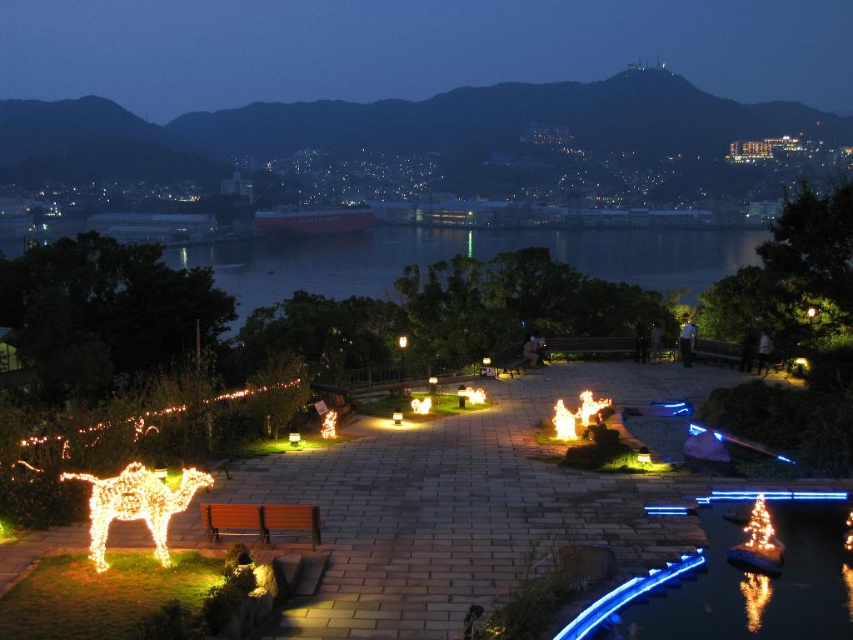
You are standing at the entrance of the park and want to reach the illuminated wireframe camel at lower left. According to the coordinates provided, in which direction should you walk from your current position to reach it?

The illuminated wireframe camel at lower left is located at coordinates point [136,504]. Since the x coordinate is 0.789 and y is 0.161, you should walk towards the lower left direction to reach it.

You are standing at the starting point of the pathway in the park. You want to reach the blue illuminated water at lower right. According to the coordinates provided, what direction should you walk to reach it?

The blue illuminated water at lower right is located at coordinates point [740,579], so you should walk towards the lower right direction to reach it.